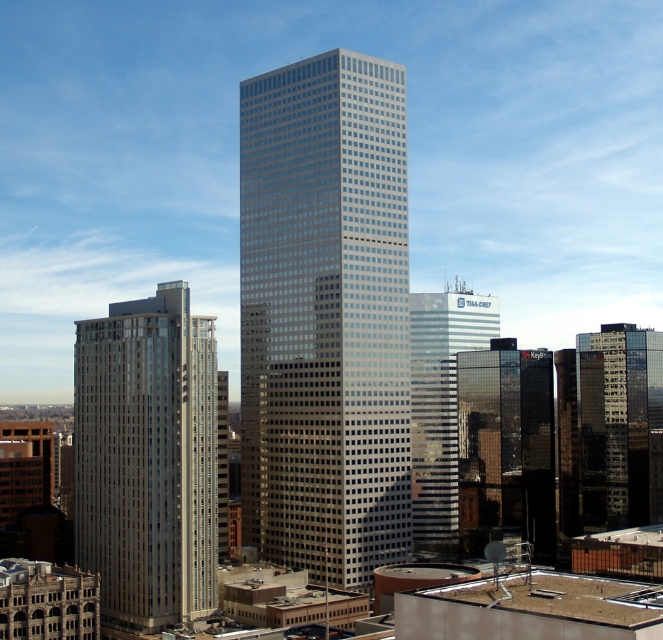
Based on the photo, measure the distance from glassy silver skyscraper at center to shiny glass skyscraper at right.

They are 338.33 feet apart.

Can you confirm if glassy silver skyscraper at center is positioned above shiny glass skyscraper at right?

Indeed, glassy silver skyscraper at center is positioned over shiny glass skyscraper at right.

Image resolution: width=663 pixels, height=640 pixels. I want to click on glassy silver skyscraper at center, so click(326, 316).

Find the location of a particular element. glassy silver skyscraper at center is located at coordinates (326, 316).

Looking at this image, who is shorter, glassy silver skyscraper at center or shiny black glass building at center?

With less height is shiny black glass building at center.

Is glassy silver skyscraper at center behind shiny black glass building at center?

No, glassy silver skyscraper at center is closer to the viewer.

Does point (391, 392) come behind point (548, 468)?

No, (391, 392) is closer to viewer.

The image size is (663, 640). In order to click on glassy silver skyscraper at center in this screenshot , I will do `click(326, 316)`.

Who is lower down, shiny black glass building at center or silver reflective glass skyscraper at center?

shiny black glass building at center is lower down.

Does point (518, 403) lie behind point (432, 349)?

That is False.

Identify the location of shiny black glass building at center. point(505,445).